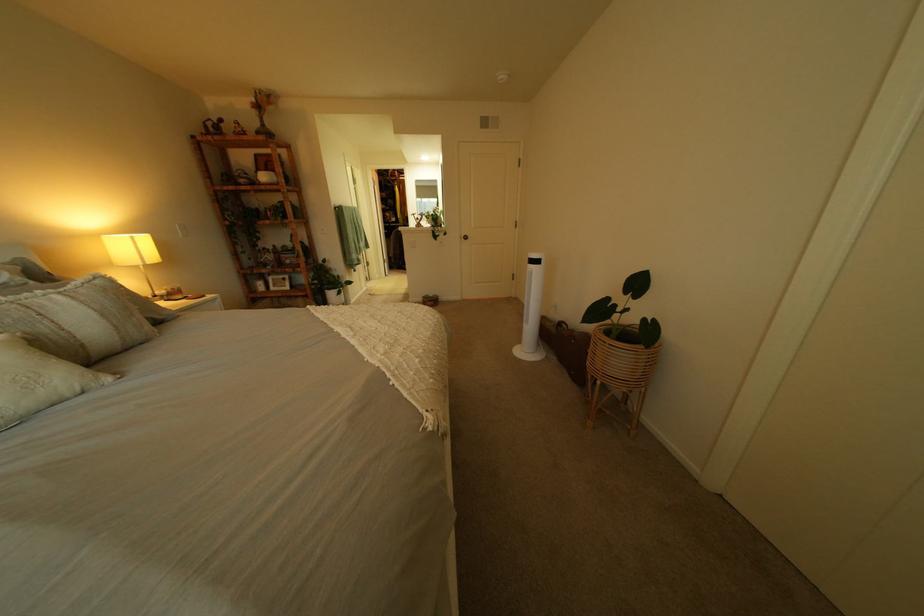
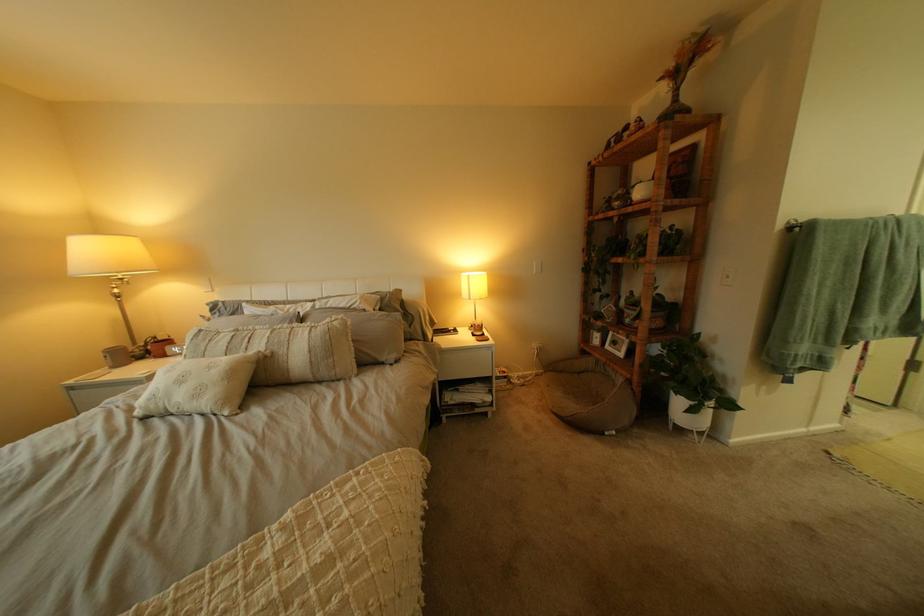
In the second image, find the point that corresponds to point 342,288 in the first image.

(687, 385)